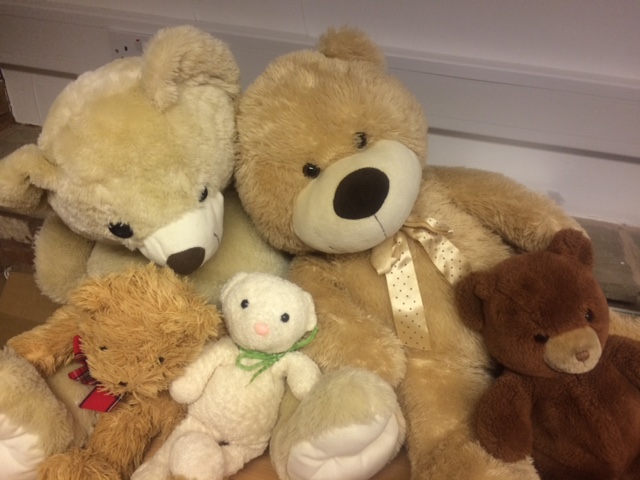
Find the location of `stuffed bears`. stuffed bears is located at coordinates (140, 109), (316, 170), (538, 301), (252, 330), (137, 330).